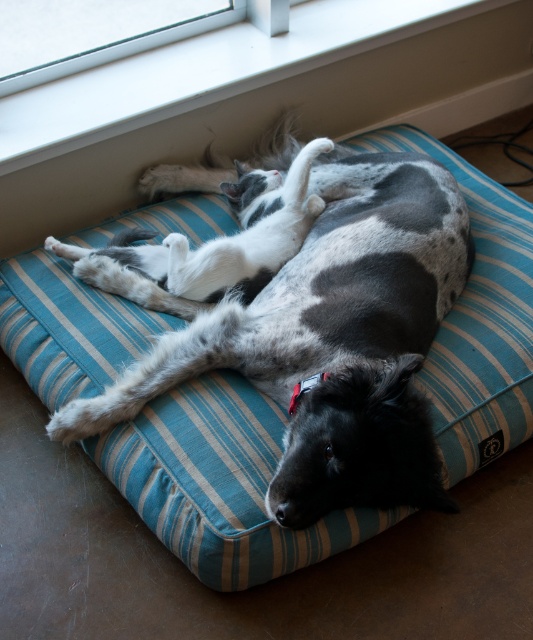
Question: Does spotted fur dog at center appear under white smooth window sill at upper center?

Choices:
 (A) no
 (B) yes

Answer: (B)

Question: Is spotted fur dog at center below white smooth window sill at upper center?

Choices:
 (A) yes
 (B) no

Answer: (A)

Question: Which point is farther to the camera?

Choices:
 (A) spotted fur dog at center
 (B) white smooth window sill at upper center

Answer: (B)

Question: Is spotted fur dog at center closer to camera compared to white smooth window sill at upper center?

Choices:
 (A) yes
 (B) no

Answer: (A)

Question: Which point is closer to the camera?

Choices:
 (A) (324, 221)
 (B) (189, 90)

Answer: (A)